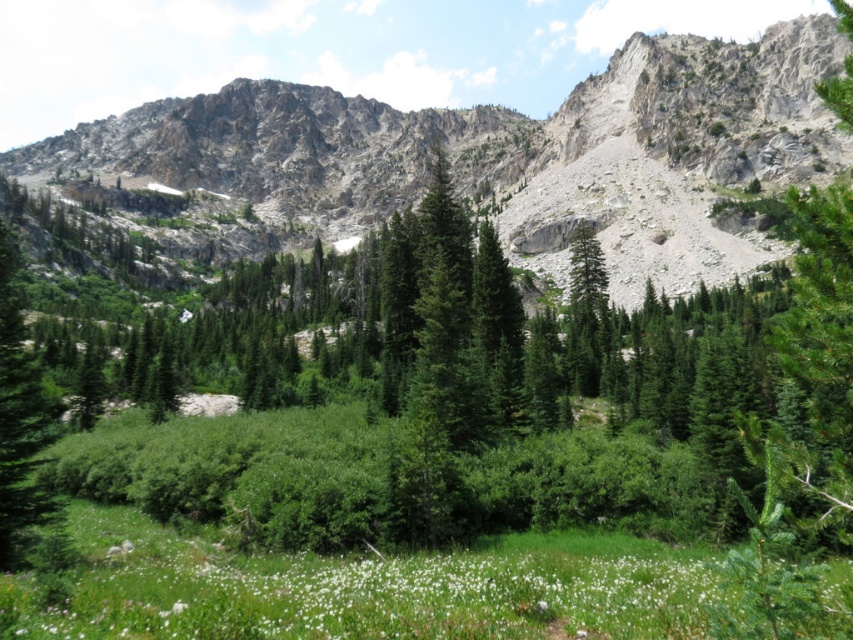
You are a hiker who wants to take a photo of the rocky gray mountain at upper center and the white fluffy flower at lower center. Which object should you focus on first if you want to capture both in a single shot without moving the camera?

The rocky gray mountain at upper center has a larger width than the white fluffy flower at lower center, so you should focus on the rocky gray mountain at upper center first to ensure it fits properly in the frame before adjusting for the smaller flower.

Consider the image. You are standing in the meadow and want to walk from the point at coordinates [474,184] to the point at coordinates [630,636]. Which direction should you move relative to your current position?

Since point [474,184] is closer to you than point [630,636], you should move forward to reach the latter point.